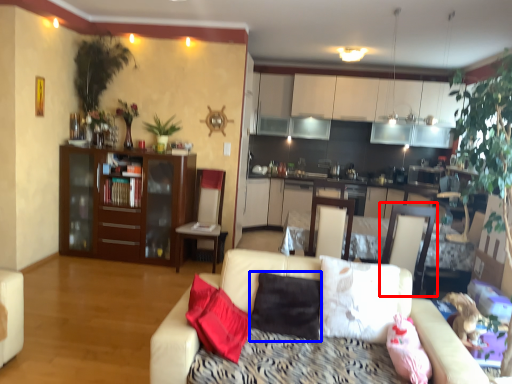
Question: Among these objects, which one is nearest to the camera, armchair (highlighted by a red box) or pillow (highlighted by a blue box)?

Choices:
 (A) armchair
 (B) pillow

Answer: (B)